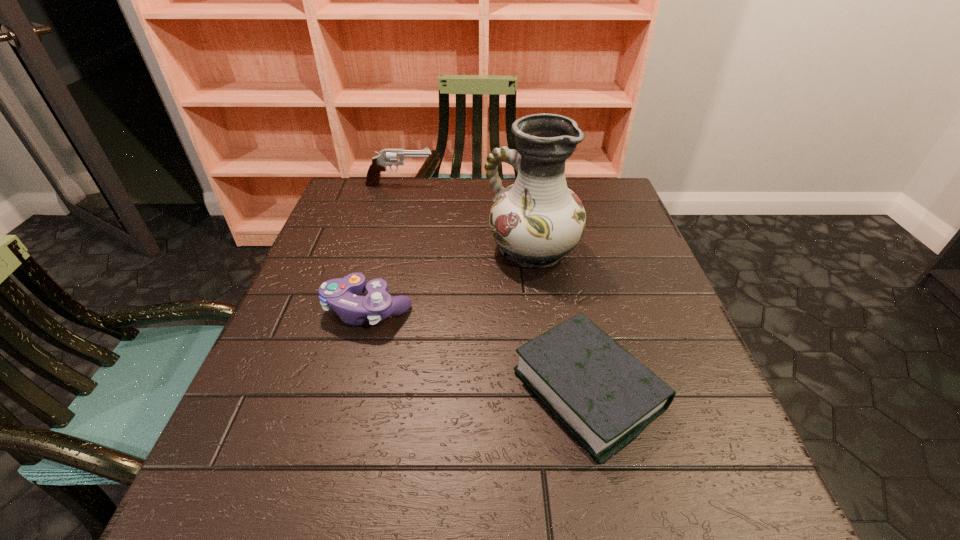
In order to click on free spot at the far left corner of the desktop in this screenshot , I will do `click(330, 216)`.

Image resolution: width=960 pixels, height=540 pixels. In the image, there is a desktop. Identify the location of free space at the far right corner. (607, 214).

Where is `free space at the near right corner of the desktop`? The image size is (960, 540). free space at the near right corner of the desktop is located at coordinates point(655,511).

Locate an element on the screen. Image resolution: width=960 pixels, height=540 pixels. free space between the second tallest object and the control is located at coordinates (384, 247).

This screenshot has width=960, height=540. In order to click on free spot between the Bible and the control in this screenshot , I will do `click(478, 350)`.

At what (x,y) coordinates should I click in order to perform the action: click on free space between the control and the vase. Please return your answer as a coordinate pair (x, y). The height and width of the screenshot is (540, 960). Looking at the image, I should click on (450, 280).

Where is `blank region between the gun and the Bible`? This screenshot has height=540, width=960. blank region between the gun and the Bible is located at coordinates (494, 287).

Where is `vacant area that lies between the second shortest object and the shortest object`? The width and height of the screenshot is (960, 540). vacant area that lies between the second shortest object and the shortest object is located at coordinates (478, 350).

The width and height of the screenshot is (960, 540). Find the location of `vacant space that is in between the shortest object and the gun`. vacant space that is in between the shortest object and the gun is located at coordinates (494, 287).

You are a GUI agent. You are given a task and a screenshot of the screen. Output one action in this format:
    pyautogui.click(x=<x>, y=<y>)
    Task: Click on the vacant space that's between the second shortest object and the gun
    
    Given the screenshot: What is the action you would take?
    pyautogui.click(x=384, y=247)